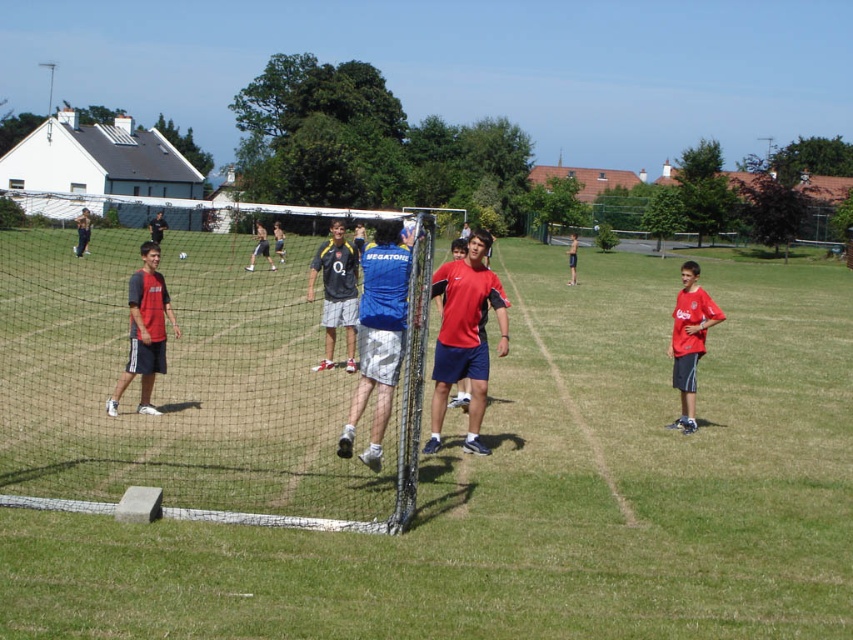
Question: Which object appears closest to the camera in this image?

Choices:
 (A) red matte shirt at center
 (B) black mesh net at center
 (C) green grass field at center

Answer: (C)

Question: Can you confirm if green grass field at center is wider than blue jersey at center?

Choices:
 (A) no
 (B) yes

Answer: (B)

Question: Is blue jersey at center above red matte shirt at right?

Choices:
 (A) yes
 (B) no

Answer: (B)

Question: Is blue jersey at center wider than dark gray fabric shorts at left?

Choices:
 (A) yes
 (B) no

Answer: (B)

Question: Which point is farther to the camera?

Choices:
 (A) green grass field at center
 (B) red fabric shirt at center
 (C) red matte shirt at center

Answer: (C)

Question: Which is farther from the blue jersey at center?

Choices:
 (A) dark gray fabric shorts at left
 (B) black mesh net at center
 (C) red matte shirt at center
 (D) red fabric shirt at center

Answer: (C)